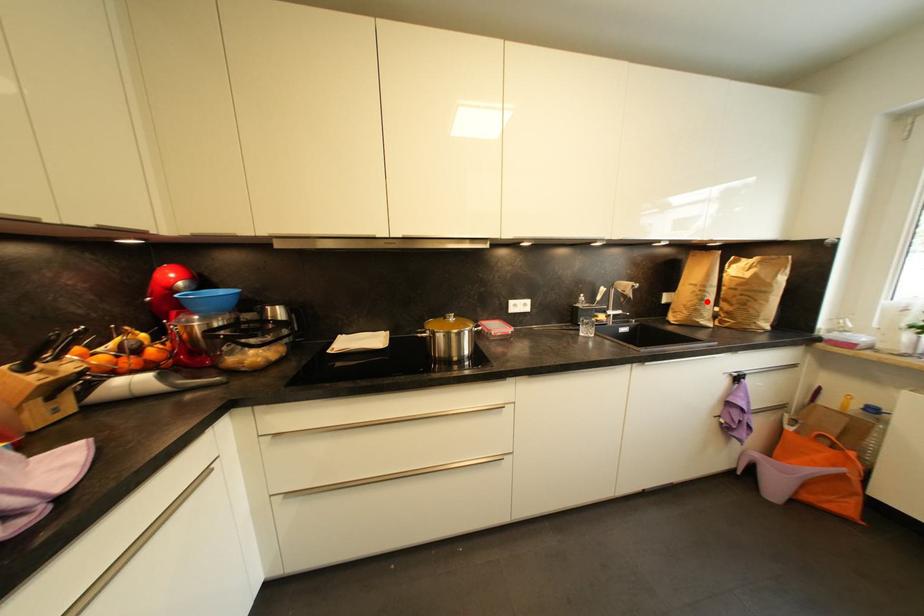
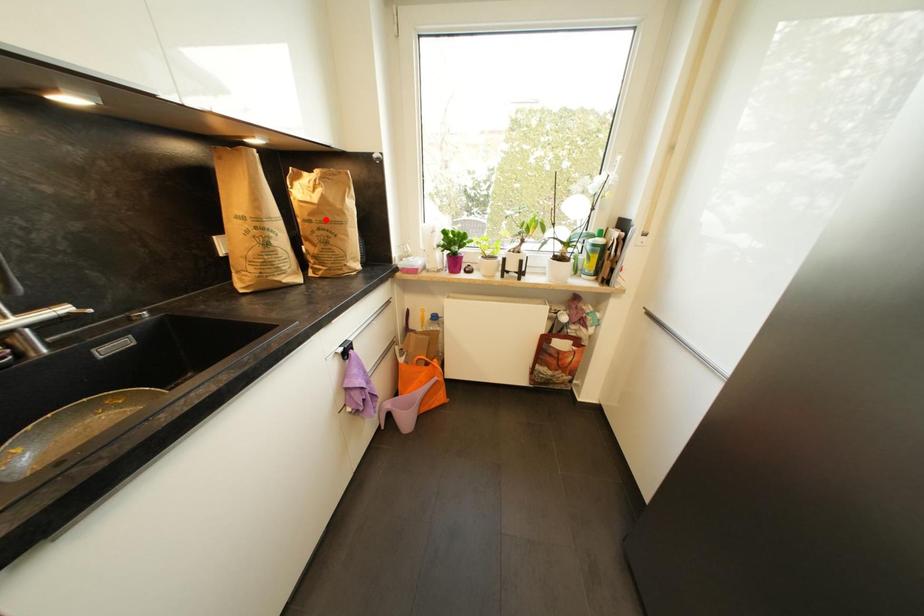
I am providing you with two images of the same scene from different viewpoints. A red point is marked on the first image and another point is marked on the second image. Is the marked point in image1 the same physical position as the marked point in image2?

No